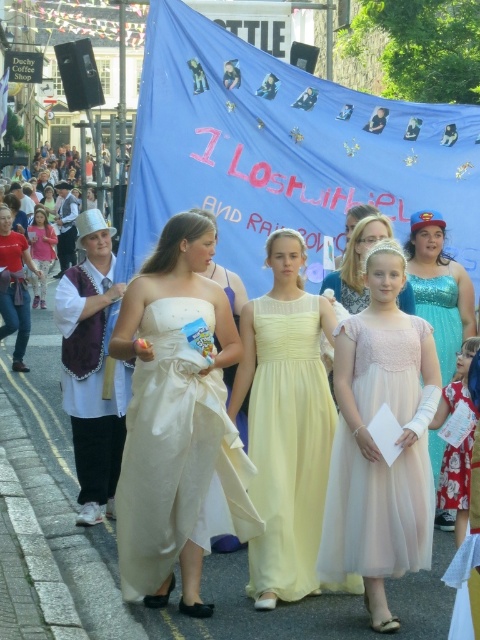
You are a photographer trying to capture a clear shot of both the pale pink tulle dress at center and the light pink satin dress at center. Since you want to ensure both are visible, which dress should you focus on first to account for their sizes?

The pale pink tulle dress at center is taller than the light pink satin dress at center, so you should focus on the pale pink tulle dress at center first to ensure it is fully in frame before adjusting for the smaller one.

You are a photographer trying to capture the light yellow satin dress at center. You need to position yourself at point A, which is located at coordinates (286, 422). Is this point the correct location to focus on the light yellow satin dress at center?

Yes, the point at coordinates (286, 422) corresponds to the light yellow satin dress at center, so positioning yourself there would correctly focus on it.

Based on the scene description, where is the light yellow satin dress at center located in the image?

The light yellow satin dress at center is located at point 0.662 on the x axis and 0.596 on the y axis.